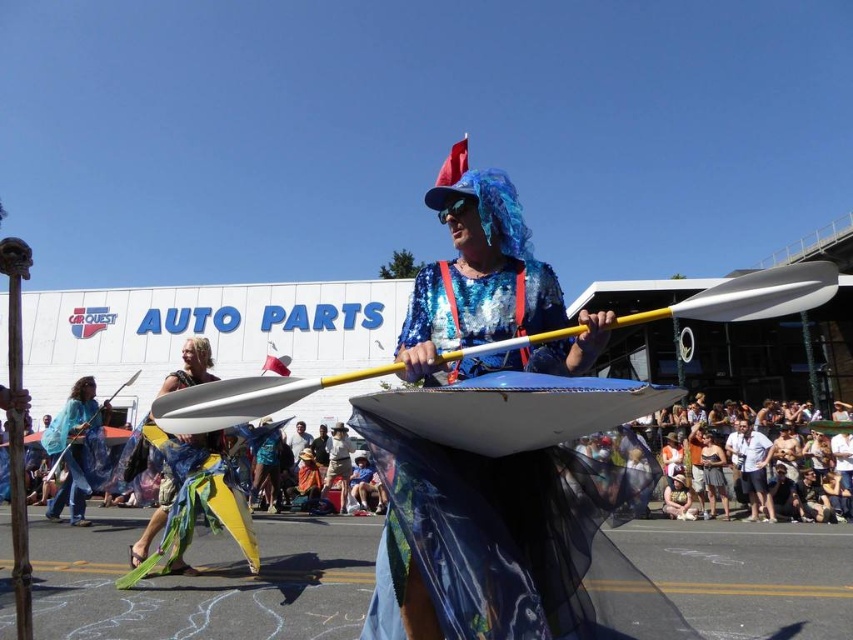
Based on the photo, you are an event planner setting up a photo booth backdrop. The backdrop has a central area where you want to place the main subject. Given the yellow fabric at center and the blue fabric cape at left, which fabric should you choose to ensure it fits within the central area without overlapping the edges?

The yellow fabric at center should be chosen because its width is less than the blue fabric cape at left, making it more suitable for the central area without overlapping the edges.

You are a photographer at the parade trying to capture the performer with both the blue fabric cape at left and the matte blue paddle at center in the frame. Which object should you position closer to the left side of your camera viewfinder to ensure both are visible?

The blue fabric cape at left is to the right of the matte blue paddle at center, so to include both in the frame, position the matte blue paddle at center closer to the left side of the viewfinder. This way, the blue fabric cape at left, being to its right, will naturally fall within the frame as well.